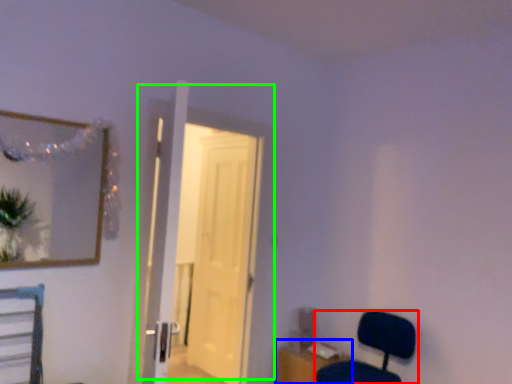
Question: Which object is positioned farthest from chair (highlighted by a red box)? Select from table (highlighted by a blue box) and door (highlighted by a green box).

Choices:
 (A) table
 (B) door

Answer: (B)